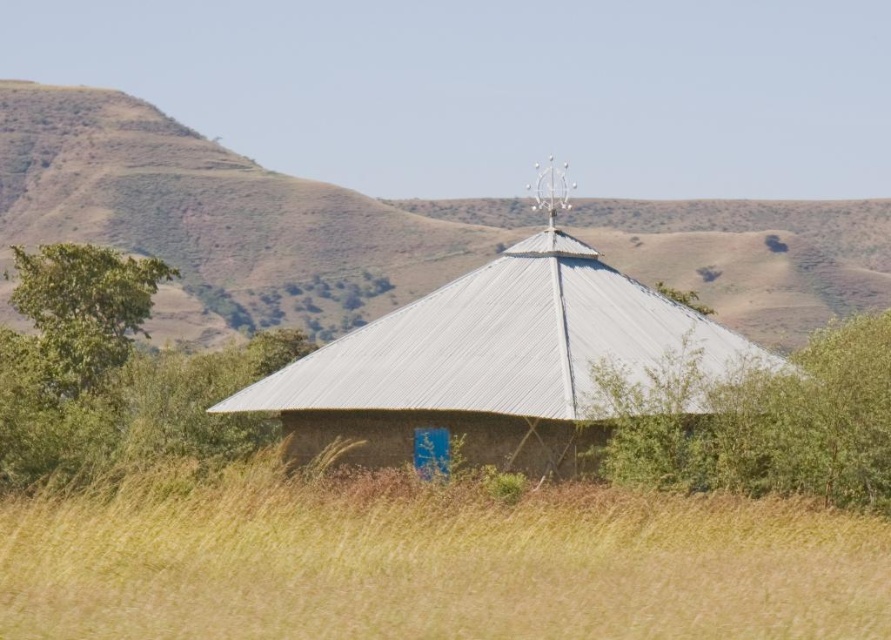
You are standing in the rural landscape and want to walk from the metallic roof at center to the green leafy tree at left. Which direction should you face to walk directly towards the tree?

You should face towards the left direction to walk directly towards the green leafy tree at left from the metallic roof at center.

You are standing at the center of the field with tall dry grasses and see the point marked at coordinates [503,364]. What does this point indicate?

The point at coordinates [503,364] indicates the metallic roof at center.

You are standing in the rural landscape looking at the small round building with a metallic roof. There are two points marked in the image. The first point is at coordinate (516, 340) and the second point is at (37, 269). Which point is nearer to you?

Point (516, 340) is closer to the camera than point (37, 269), so the first point is nearer to you.